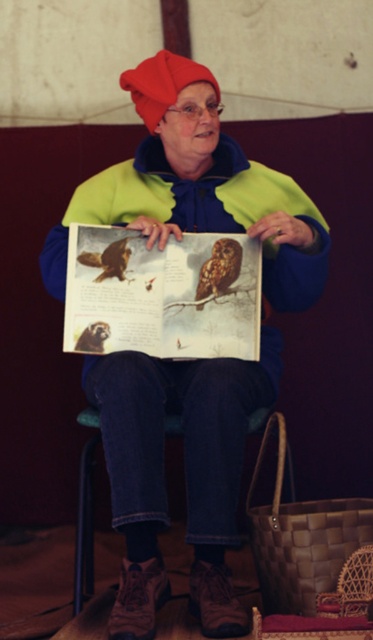
You are an assistant helping to arrange items in a display. You need to place a new item between the matte green jacket at center and the matte paper book at center. According to the scene description, which side of the book should you place the new item to ensure it is positioned correctly?

The matte green jacket at center is to the right of the matte paper book at center, so placing the new item between them would require positioning it to the right side of the matte paper book at center, next to the matte green jacket at center.

You are organizing a display and need to know the relative sizes of the items. Which object is wider, the matte green jacket at center or the brown fuzzy owl at center?

The matte green jacket at center is wider than the brown fuzzy owl at center according to the description provided.

You are standing inside the tent where the person is reading the book about owls. There are two points marked in the scene. The first point is at coordinate point [117,337] and the second is at point [229,285]. Which point is closer to you, the observer, from your current position in the tent?

Point [117,337] is in front of point [229,285], so it is closer to you as the observer in the tent.